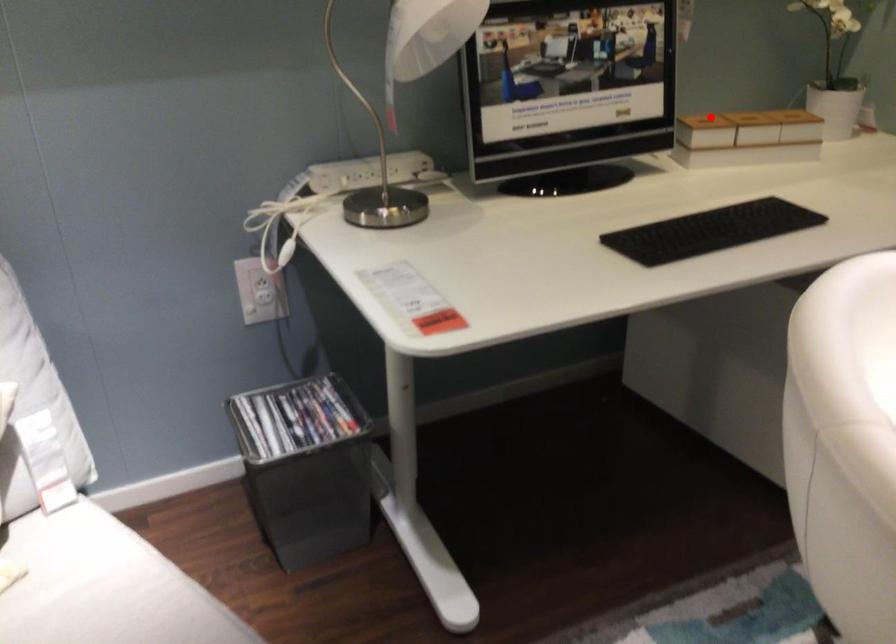
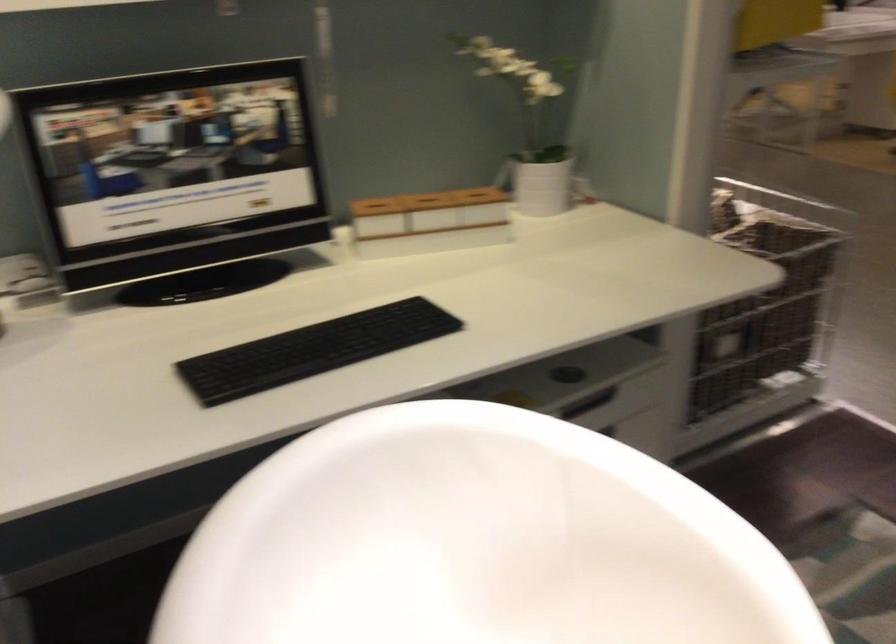
In the second image, find the point that corresponds to the highlighted location in the first image.

(375, 204)